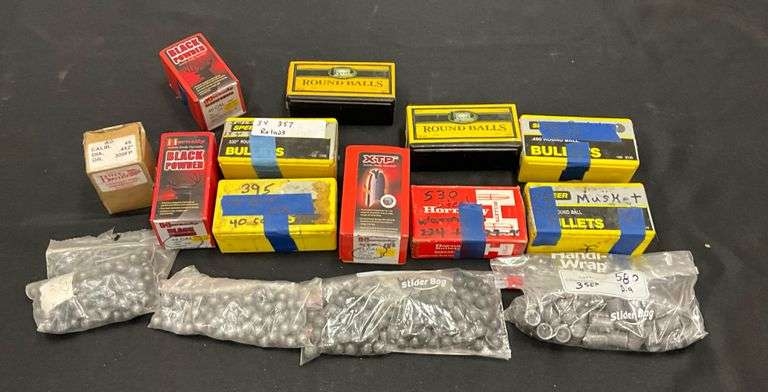
At what (x,y) coordinates should I click in order to perform the action: click on box cardboard brown. Please return your answer as a coordinate pair (x, y). Image resolution: width=768 pixels, height=392 pixels. Looking at the image, I should click on (130, 198).